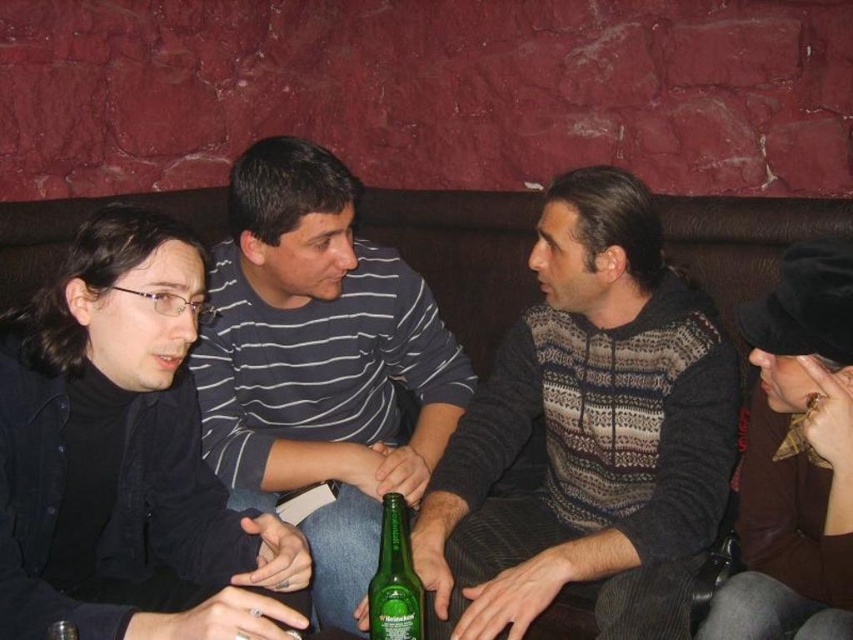
Between striped cotton shirt at center and brown knitted hat at upper right, which one is positioned higher?

Positioned higher is striped cotton shirt at center.

Between striped cotton shirt at center and brown knitted hat at upper right, which one appears on the left side from the viewer's perspective?

Positioned to the left is striped cotton shirt at center.

Locate an element on the screen. The width and height of the screenshot is (853, 640). striped cotton shirt at center is located at coordinates (320, 362).

Is brown knitted hat at upper right taller than green glass bottle at center?

Correct, brown knitted hat at upper right is much taller as green glass bottle at center.

Can you confirm if brown knitted hat at upper right is shorter than green glass bottle at center?

No.

The image size is (853, 640). Identify the location of brown knitted hat at upper right. (796, 460).

Is knitted sweater at center to the right of green glass bottle at center from the viewer's perspective?

Correct, you'll find knitted sweater at center to the right of green glass bottle at center.

Locate an element on the screen. This screenshot has height=640, width=853. knitted sweater at center is located at coordinates (589, 435).